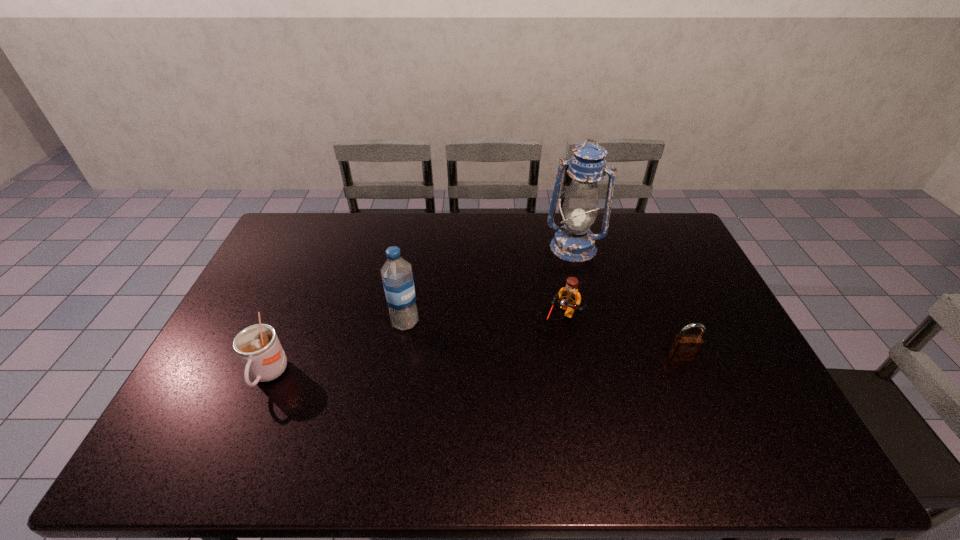
Find the location of a particular element. Image resolution: width=960 pixels, height=540 pixels. vacant region between the padlock and the water bottle is located at coordinates click(x=543, y=340).

The image size is (960, 540). I want to click on vacant area that lies between the water bottle and the third tallest object, so 336,349.

Find the location of a particular element. Image resolution: width=960 pixels, height=540 pixels. empty space that is in between the tallest object and the padlock is located at coordinates (627, 302).

I want to click on free spot between the fourth object from right to left and the lantern, so click(490, 285).

Locate an element on the screen. The image size is (960, 540). vacant area between the farthest object and the rightmost object is located at coordinates (627, 302).

The image size is (960, 540). I want to click on free space that is in between the leftmost object and the lantern, so coord(420,311).

Find the location of a particular element. free space between the cup and the padlock is located at coordinates (474, 366).

Locate an element on the screen. Image resolution: width=960 pixels, height=540 pixels. unoccupied area between the farthest object and the leftmost object is located at coordinates (420, 311).

Find the location of `object that stands as the third closest to the Lego`. object that stands as the third closest to the Lego is located at coordinates (397, 276).

Locate which object ranks second in proximity to the cup. Please provide its 2D coordinates. Your answer should be formatted as a tuple, i.e. [(x, y)], where the tuple contains the x and y coordinates of a point satisfying the conditions above.

[(570, 298)]